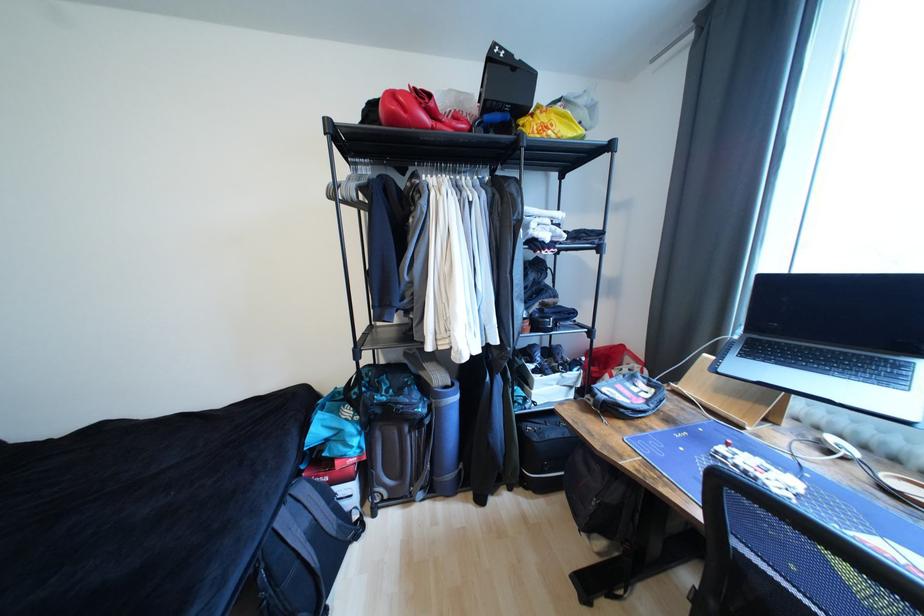
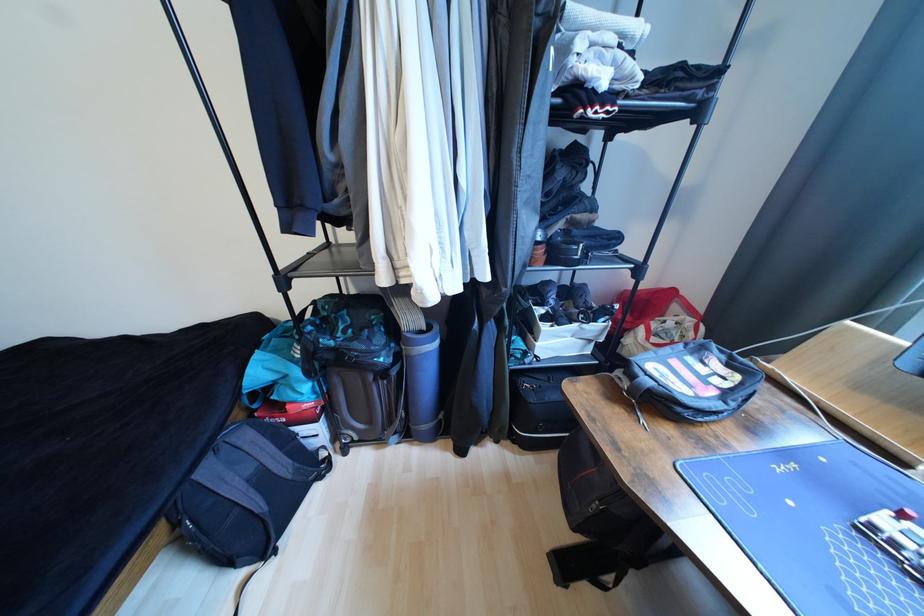
Where in the second image is the point corresponding to [543,379] from the first image?

(552, 329)